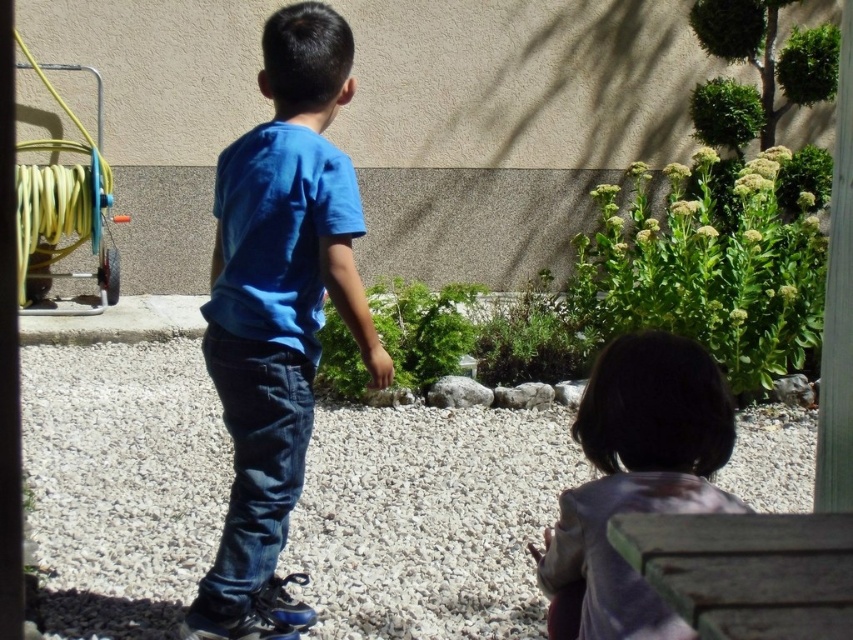
Question: Which point appears farthest from the camera in this image?

Choices:
 (A) (675, 401)
 (B) (328, 35)

Answer: (B)

Question: Can you confirm if white gravel at center is wider than blue cotton shirt at center?

Choices:
 (A) no
 (B) yes

Answer: (B)

Question: Which object is the farthest from the white gravel at center?

Choices:
 (A) smooth gray rock at center
 (B) gray gravel stone at center
 (C) dark blue denim jeans at center

Answer: (C)

Question: Which of the following is the closest to the observer?

Choices:
 (A) (535, 397)
 (B) (213, 621)

Answer: (B)

Question: Can you confirm if white gravel at center is positioned below blue cotton shirt at center?

Choices:
 (A) yes
 (B) no

Answer: (A)

Question: Considering the relative positions of blue cotton shirt at center and dark blue denim jeans at center in the image provided, where is blue cotton shirt at center located with respect to dark blue denim jeans at center?

Choices:
 (A) left
 (B) right

Answer: (B)